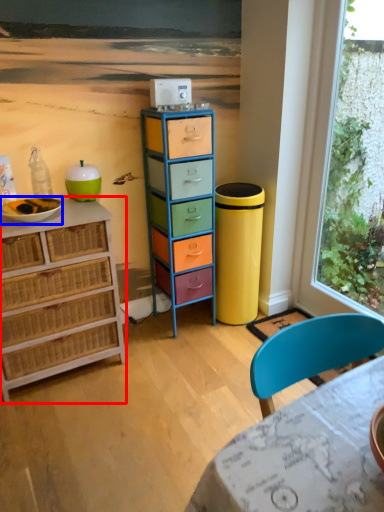
Question: Among these objects, which one is farthest to the camera, chest of drawers (highlighted by a red box) or bowl (highlighted by a blue box)?

Choices:
 (A) chest of drawers
 (B) bowl

Answer: (B)